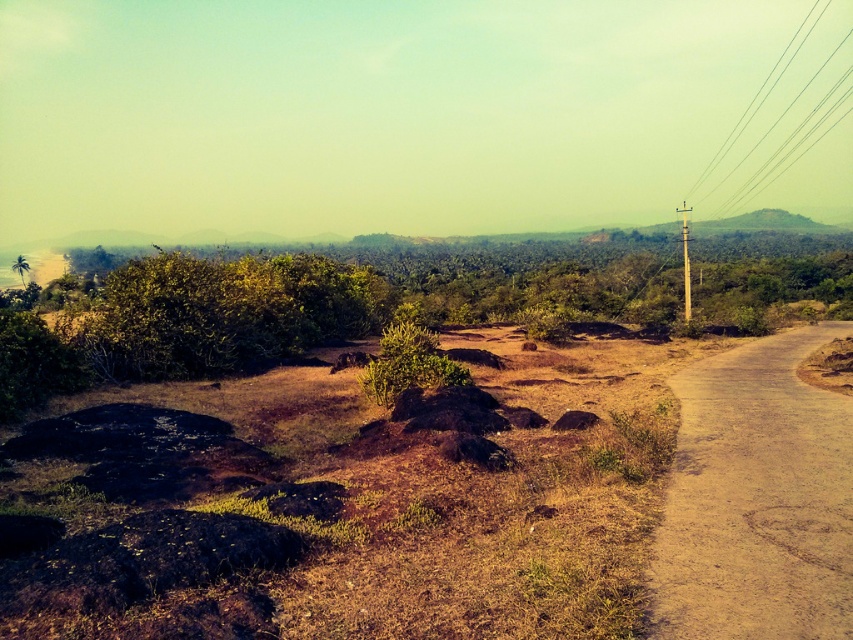
What do you see at coordinates (756, 499) in the screenshot? I see `dirt road at right` at bounding box center [756, 499].

What do you see at coordinates (756, 499) in the screenshot? The width and height of the screenshot is (853, 640). I see `dirt road at right` at bounding box center [756, 499].

Identify the location of dirt road at right. (756, 499).

Does brown earthy dirt field at center have a lesser width compared to metallic wire at right?

Indeed, brown earthy dirt field at center has a lesser width compared to metallic wire at right.

Can you confirm if brown earthy dirt field at center is shorter than metallic wire at right?

Yes, brown earthy dirt field at center is shorter than metallic wire at right.

Between point (207, 419) and point (757, 172), which one is positioned behind?

The point (757, 172) is behind.

Where is `brown earthy dirt field at center`? Image resolution: width=853 pixels, height=640 pixels. brown earthy dirt field at center is located at coordinates (341, 502).

Is brown earthy dirt field at center to the right of dirt road at right from the viewer's perspective?

No, brown earthy dirt field at center is not to the right of dirt road at right.

Does brown earthy dirt field at center lie in front of dirt road at right?

Yes, it is in front of dirt road at right.

Does point (515, 333) come farther from viewer compared to point (767, 625)?

That is True.

This screenshot has width=853, height=640. In order to click on brown earthy dirt field at center in this screenshot , I will do `click(341, 502)`.